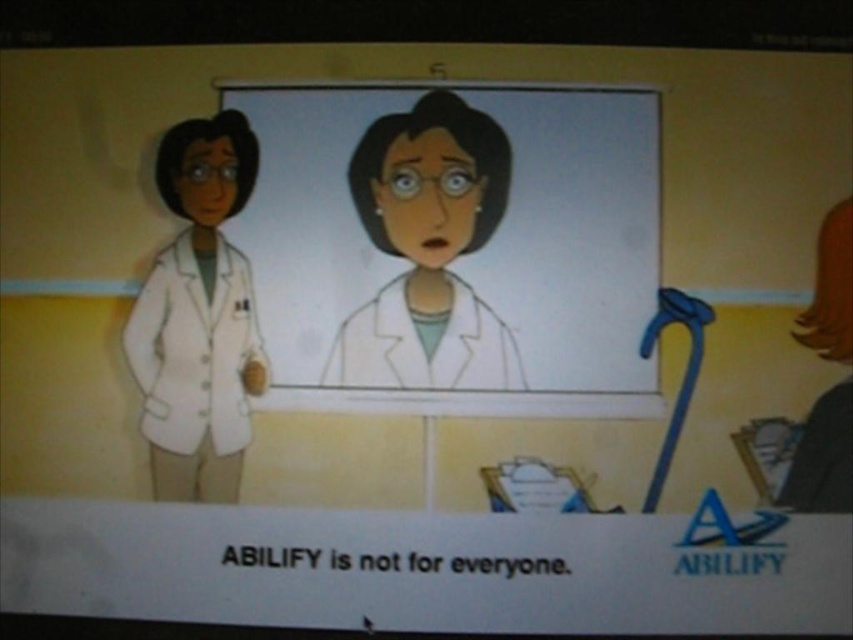
Question: Which object is closer to the camera taking this photo?

Choices:
 (A) white matte lab coat at left
 (B) matte white coat at center

Answer: (A)

Question: Observing the image, what is the correct spatial positioning of white lab coat at center in reference to matte white coat at center?

Choices:
 (A) right
 (B) left

Answer: (A)

Question: Does matte white coat at center have a lesser width compared to white matte lab coat at left?

Choices:
 (A) no
 (B) yes

Answer: (A)

Question: Estimate the real-world distances between objects in this image. Which object is closer to the white matte lab coat at left?

Choices:
 (A) matte white coat at center
 (B) white lab coat at center

Answer: (B)

Question: Considering the real-world distances, which object is closest to the white matte lab coat at left?

Choices:
 (A) matte white coat at center
 (B) white lab coat at center

Answer: (B)

Question: Considering the relative positions of matte white coat at center and white matte lab coat at left in the image provided, where is matte white coat at center located with respect to white matte lab coat at left?

Choices:
 (A) above
 (B) below

Answer: (A)